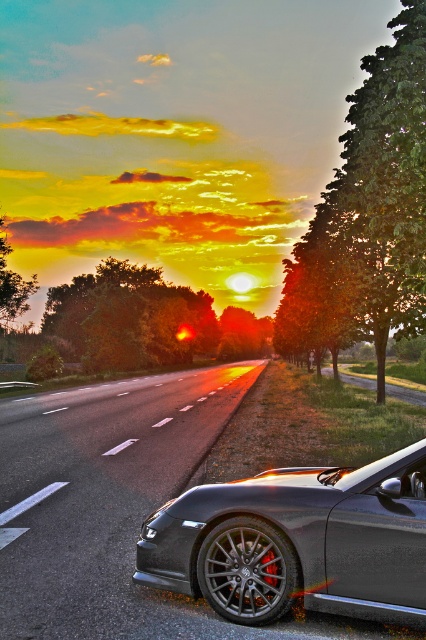
You are driving a car that is 5.00 meters long. You see the smooth asphalt highway at center and the satin black car at center. Can your car fit entirely between them without overlapping either?

The distance between the smooth asphalt highway at center and the satin black car at center is 3.00 meters. Since your car is 5.00 meters long, it cannot fit entirely between them without overlapping either.

You are driving a car that is exactly the same width as the satin black car at center. The road you are on is the smooth asphalt highway at center. Can you safely drive in the middle of the road without touching either side?

Yes, because the smooth asphalt highway at center is wider than the satin black car at center, so there is enough space on both sides to drive safely in the middle.

You are a driver approaching the smooth asphalt highway at center and see the satin black car at center ahead of you. Can you determine which object takes up more space in the image?

The smooth asphalt highway at center has a larger size compared to the satin black car at center, so it takes up more space in the image.